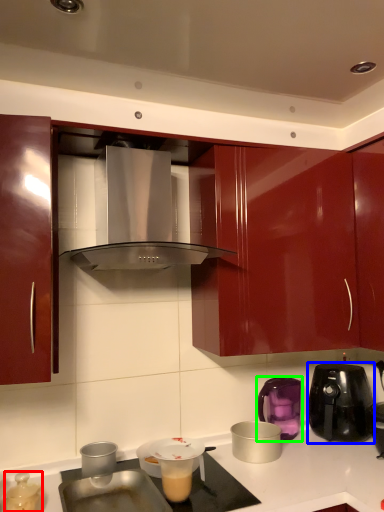
Question: Which is nearer to the kitchen appliance (highlighted by a red box)? kitchen appliance (highlighted by a blue box) or kitchen appliance (highlighted by a green box).

Choices:
 (A) kitchen appliance
 (B) kitchen appliance

Answer: (B)